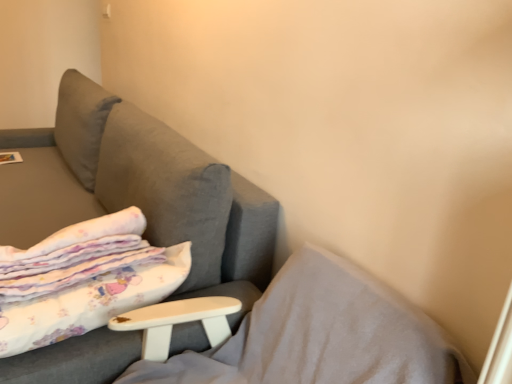
Question: Does matte white magazine at upper left lie in front of white cotton blanket at left?

Choices:
 (A) no
 (B) yes

Answer: (A)

Question: Could you tell me if matte white magazine at upper left is facing white cotton blanket at left?

Choices:
 (A) yes
 (B) no

Answer: (B)

Question: From a real-world perspective, is matte white magazine at upper left located higher than white cotton blanket at left?

Choices:
 (A) no
 (B) yes

Answer: (A)

Question: Is matte white magazine at upper left positioned with its back to white cotton blanket at left?

Choices:
 (A) no
 (B) yes

Answer: (A)

Question: Does matte white magazine at upper left have a larger size compared to white cotton blanket at left?

Choices:
 (A) yes
 (B) no

Answer: (B)

Question: From the image's perspective, is matte white magazine at upper left located beneath white cotton blanket at left?

Choices:
 (A) yes
 (B) no

Answer: (B)

Question: Is white soft pillow at lower left facing away from white cotton blanket at left?

Choices:
 (A) yes
 (B) no

Answer: (B)

Question: From the image's perspective, is white soft pillow at lower left on white cotton blanket at left?

Choices:
 (A) no
 (B) yes

Answer: (A)

Question: Is white soft pillow at lower left smaller than white cotton blanket at left?

Choices:
 (A) no
 (B) yes

Answer: (A)

Question: Is white soft pillow at lower left wider than white cotton blanket at left?

Choices:
 (A) yes
 (B) no

Answer: (A)

Question: Is white soft pillow at lower left located outside white cotton blanket at left?

Choices:
 (A) yes
 (B) no

Answer: (A)

Question: From a real-world perspective, is white soft pillow at lower left on top of white cotton blanket at left?

Choices:
 (A) no
 (B) yes

Answer: (A)

Question: From the image's perspective, is white cotton blanket at left below white soft pillow at lower left?

Choices:
 (A) no
 (B) yes

Answer: (A)